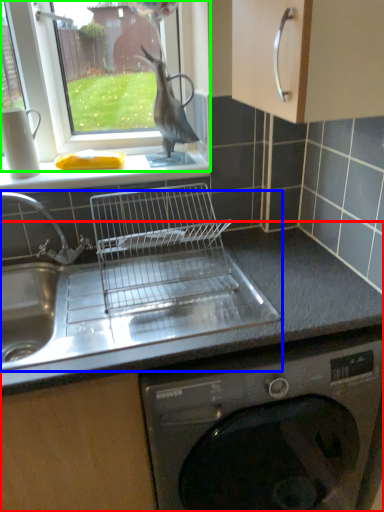
Question: Which is farther away from countertop (highlighted by a red box)? sink (highlighted by a blue box) or window (highlighted by a green box)?

Choices:
 (A) sink
 (B) window

Answer: (B)